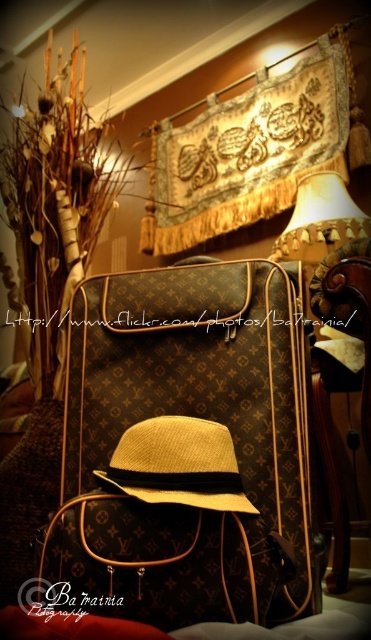
Does straw fedora at center appear on the right side of beige fabric lampshade at upper right?

In fact, straw fedora at center is to the left of beige fabric lampshade at upper right.

From the picture: Between straw fedora at center and beige fabric lampshade at upper right, which one is positioned higher?

beige fabric lampshade at upper right is above.

Which is in front, point (132, 476) or point (304, 193)?

Point (132, 476)

This screenshot has width=371, height=640. What are the coordinates of `straw fedora at center` in the screenshot? It's located at (178, 465).

Is brown monogrammed suitcase at center positioned at the back of brown leather chair at center?

No, it is in front of brown leather chair at center.

Does point (43, 561) lie behind point (316, 397)?

No, it is in front of (316, 397).

Identify the location of brown monogrammed suitcase at center. The width and height of the screenshot is (371, 640). (185, 449).

Between brown leather chair at center and straw fedora at center, which one is positioned higher?

straw fedora at center

Identify the location of brown leather chair at center. This screenshot has width=371, height=640. (340, 380).